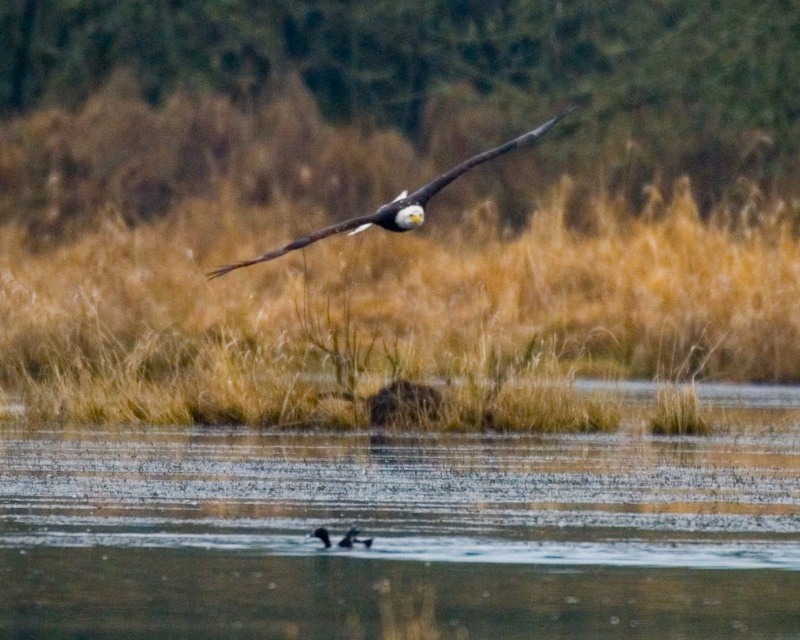
Question: Is clear water at center wider than white-feathered eagle at center?

Choices:
 (A) yes
 (B) no

Answer: (A)

Question: Which of the following is the farthest from the observer?

Choices:
 (A) (644, 608)
 (B) (496, 148)

Answer: (B)

Question: Is clear water at center closer to camera compared to white-feathered eagle at center?

Choices:
 (A) no
 (B) yes

Answer: (B)

Question: Is the position of clear water at center less distant than that of white-feathered eagle at center?

Choices:
 (A) yes
 (B) no

Answer: (A)